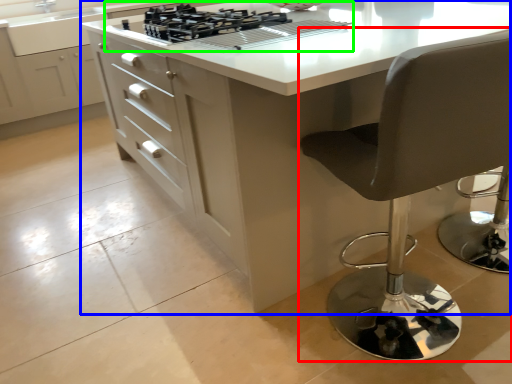
Question: Based on their relative distances, which object is nearer to chair (highlighted by a red box)? Choose from table (highlighted by a blue box) and gas stove (highlighted by a green box).

Choices:
 (A) table
 (B) gas stove

Answer: (A)